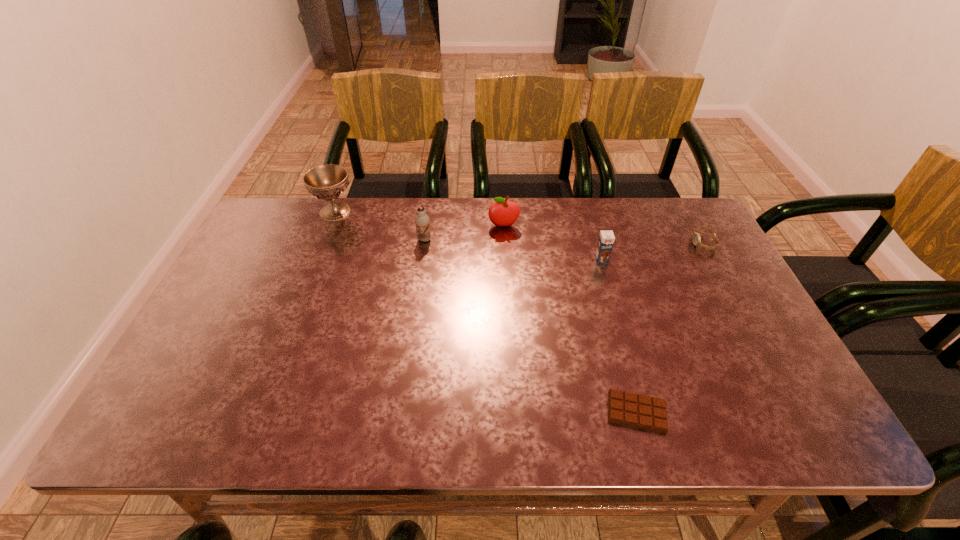
Where is `vacant space that satisfies the following two spatial constraints: 1. on the face of the rightmost object; 2. on the front label of the shorter chocolate milk`? The height and width of the screenshot is (540, 960). vacant space that satisfies the following two spatial constraints: 1. on the face of the rightmost object; 2. on the front label of the shorter chocolate milk is located at coordinates (712, 260).